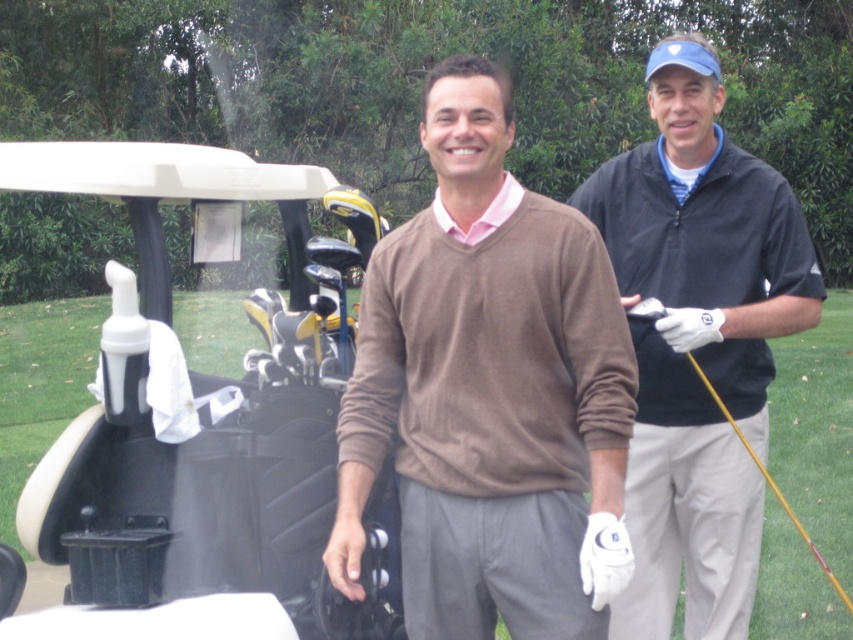
You are a photographer trying to capture a photo of both the brown sweater at center and the white matte golf cart at left in the same frame. Given their sizes, which object should you focus on first to ensure both are clearly visible in the photo?

The brown sweater at center is smaller than the white matte golf cart at left, so you should focus on the brown sweater at center first to ensure its details are sharp while the larger golf cart remains in focus.

You are a golfer standing at the point labeled as point (x=316, y=452). You want to walk straight towards the golf cart in the background. Will you pass by the point labeled as point (x=483, y=444) along the way?

Yes, because point (x=483, y=444) is in front of point (x=316, y=452), so walking towards the golf cart would require passing through point (x=483, y=444) first.